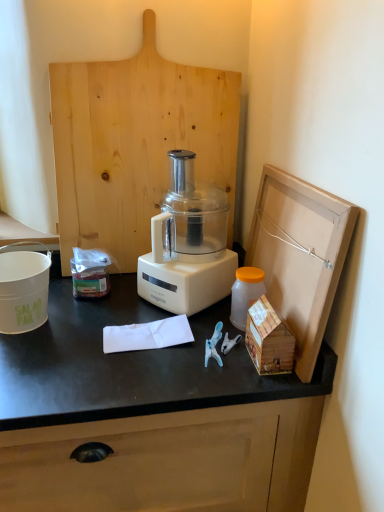
Question: Should I look upward or downward to see wooden house at right, marked as the 2th wood in a back-to-front arrangement?

Choices:
 (A) up
 (B) down

Answer: (B)

Question: Is wooden house at right, marked as the first wood in a right-to-left arrangement, behind translucent plastic container at center-left?

Choices:
 (A) no
 (B) yes

Answer: (A)

Question: Can you confirm if wooden house at right, which is the 1th wood in bottom-to-top order, is positioned to the left of translucent plastic container at center-left?

Choices:
 (A) no
 (B) yes

Answer: (A)

Question: Is translucent plastic container at center-left located within wooden house at right, which is the second wood in left-to-right order?

Choices:
 (A) yes
 (B) no

Answer: (B)

Question: Is wooden house at right, which ranks as the second wood in top-to-bottom order, shorter than translucent plastic container at center-left?

Choices:
 (A) yes
 (B) no

Answer: (B)

Question: From the image's perspective, is wooden house at right, the 1th wood in the front-to-back sequence, over translucent plastic container at center-left?

Choices:
 (A) no
 (B) yes

Answer: (A)

Question: Would you consider wooden house at right, which is the second wood in left-to-right order, to be distant from translucent plastic container at center-left?

Choices:
 (A) yes
 (B) no

Answer: (B)

Question: Considering the relative sizes of translucent plastic bottle at right and wooden house at right, marked as the 2th wood in a back-to-front arrangement, in the image provided, is translucent plastic bottle at right shorter than wooden house at right, marked as the 2th wood in a back-to-front arrangement,?

Choices:
 (A) yes
 (B) no

Answer: (B)

Question: Does translucent plastic bottle at right have a smaller size compared to wooden house at right, the 1th wood in the front-to-back sequence?

Choices:
 (A) yes
 (B) no

Answer: (A)

Question: Considering the relative sizes of translucent plastic bottle at right and wooden house at right, marked as the 2th wood in a back-to-front arrangement, in the image provided, is translucent plastic bottle at right bigger than wooden house at right, marked as the 2th wood in a back-to-front arrangement,?

Choices:
 (A) yes
 (B) no

Answer: (B)

Question: Is translucent plastic bottle at right to the left of wooden house at right, marked as the first wood in a right-to-left arrangement, from the viewer's perspective?

Choices:
 (A) yes
 (B) no

Answer: (A)

Question: Considering the relative sizes of translucent plastic bottle at right and wooden house at right, which is the 1th wood in bottom-to-top order, in the image provided, is translucent plastic bottle at right wider than wooden house at right, which is the 1th wood in bottom-to-top order,?

Choices:
 (A) no
 (B) yes

Answer: (A)

Question: From the image's perspective, is translucent plastic bottle at right under wooden house at right, marked as the first wood in a right-to-left arrangement?

Choices:
 (A) no
 (B) yes

Answer: (A)

Question: Is white matte salad pail at left positioned with its back to translucent plastic bottle at right?

Choices:
 (A) no
 (B) yes

Answer: (A)